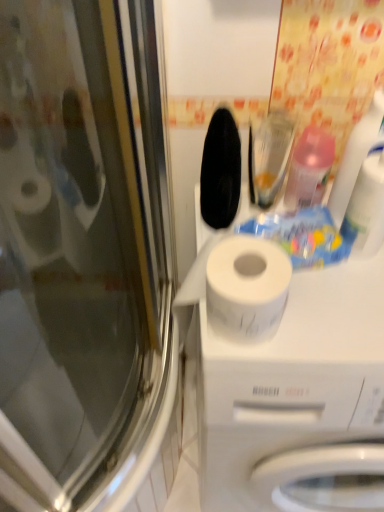
Describe the element at coordinates (357, 156) in the screenshot. The image size is (384, 512). I see `translucent plastic spray bottle at upper right, the second cleaning product positioned from the left` at that location.

What do you see at coordinates (309, 169) in the screenshot? Image resolution: width=384 pixels, height=512 pixels. I see `pink translucent bottle at upper right, the 1th cleaning product viewed from the left` at bounding box center [309, 169].

This screenshot has height=512, width=384. What are the coordinates of `transparent glass screen door at left` in the screenshot? It's located at (85, 261).

Is transparent glass screen door at left surrounded by white matte toilet paper at center?

Actually, transparent glass screen door at left is outside white matte toilet paper at center.

From a real-world perspective, which object rests below the other?

In real-world perspective, white matte toilet paper at center is lower.

Does white matte toilet paper at center turn towards transparent glass screen door at left?

No, white matte toilet paper at center is not facing towards transparent glass screen door at left.

Which of these two, white matte toilet paper at center or transparent glass screen door at left, is smaller?

Smaller between the two is transparent glass screen door at left.

Considering the positions of objects translucent plastic spray bottle at upper right, which is the first cleaning product in right-to-left order, and pink translucent bottle at upper right, the 1th cleaning product viewed from the left, in the image provided, who is more to the left, translucent plastic spray bottle at upper right, which is the first cleaning product in right-to-left order, or pink translucent bottle at upper right, the 1th cleaning product viewed from the left,?

pink translucent bottle at upper right, the 1th cleaning product viewed from the left, is more to the left.

Identify the location of cleaning product below the pink translucent bottle at upper right, acting as the second cleaning product starting from the right (from the image's perspective). (357, 156).

Is translucent plastic spray bottle at upper right, the second cleaning product positioned from the left, positioned far away from pink translucent bottle at upper right, acting as the second cleaning product starting from the right?

No.

In the image, there is a translucent plastic spray bottle at upper right, the second cleaning product positioned from the left. Where is `machine below it (from a real-world perspective)`? The image size is (384, 512). machine below it (from a real-world perspective) is located at coordinates (283, 368).

How far apart are white matte toilet paper at center and translucent plastic spray bottle at upper right, the second cleaning product positioned from the left?

white matte toilet paper at center and translucent plastic spray bottle at upper right, the second cleaning product positioned from the left, are 12.85 inches apart.

From a real-world perspective, is white matte toilet paper at center under translucent plastic spray bottle at upper right, the second cleaning product positioned from the left?

Yes, from a real-world perspective, white matte toilet paper at center is below translucent plastic spray bottle at upper right, the second cleaning product positioned from the left.

How different are the orientations of white matte toilet paper at center and translucent plastic spray bottle at upper right, which is the first cleaning product in right-to-left order, in degrees?

0.588 degrees separate the facing orientations of white matte toilet paper at center and translucent plastic spray bottle at upper right, which is the first cleaning product in right-to-left order.

From a real-world perspective, is transparent glass screen door at left under pink translucent bottle at upper right, the 1th cleaning product viewed from the left?

Yes, from a real-world perspective, transparent glass screen door at left is under pink translucent bottle at upper right, the 1th cleaning product viewed from the left.

Considering the positions of points (49, 291) and (299, 149), is point (49, 291) farther from camera compared to point (299, 149)?

Yes, point (49, 291) is behind point (299, 149).

From the picture: Is transparent glass screen door at left touching pink translucent bottle at upper right, acting as the second cleaning product starting from the right?

No, transparent glass screen door at left is not with pink translucent bottle at upper right, acting as the second cleaning product starting from the right.

From a real-world perspective, count 2nd cleaning products upward from the transparent glass screen door at left and point to it. Please provide its 2D coordinates.

[(357, 156)]

Is point (336, 207) closer or farther from the camera than point (100, 24)?

Point (336, 207) is positioned farther from the camera compared to point (100, 24).

Are translucent plastic spray bottle at upper right, the second cleaning product positioned from the left, and transparent glass screen door at left located far from each other?

No, translucent plastic spray bottle at upper right, the second cleaning product positioned from the left, is not far away from transparent glass screen door at left.

Can you confirm if translucent plastic spray bottle at upper right, which is the first cleaning product in right-to-left order, is bigger than transparent glass screen door at left?

Actually, translucent plastic spray bottle at upper right, which is the first cleaning product in right-to-left order, might be smaller than transparent glass screen door at left.

Is point (225, 486) positioned before point (289, 199)?

No.

Consider the image. Considering the sizes of white matte toilet paper at center and pink translucent bottle at upper right, the 1th cleaning product viewed from the left, in the image, is white matte toilet paper at center wider or thinner than pink translucent bottle at upper right, the 1th cleaning product viewed from the left,?

Clearly, white matte toilet paper at center has more width compared to pink translucent bottle at upper right, the 1th cleaning product viewed from the left.

From the image's perspective, is white matte toilet paper at center located beneath pink translucent bottle at upper right, the 1th cleaning product viewed from the left?

Correct, white matte toilet paper at center appears lower than pink translucent bottle at upper right, the 1th cleaning product viewed from the left, in the image.

Could you tell me if white matte toilet paper at center is facing pink translucent bottle at upper right, acting as the second cleaning product starting from the right?

No, white matte toilet paper at center is not oriented towards pink translucent bottle at upper right, acting as the second cleaning product starting from the right.

Can you confirm if transparent glass screen door at left is shorter than white matte toilet paper at center?

Correct, transparent glass screen door at left is not as tall as white matte toilet paper at center.

Does transparent glass screen door at left turn towards white matte toilet paper at center?

Yes, transparent glass screen door at left is oriented towards white matte toilet paper at center.

You are a GUI agent. You are given a task and a screenshot of the screen. Output one action in this format:
    pyautogui.click(x=<x>, y=<y>)
    Task: Click on the machine on the right of transparent glass screen door at left
    This screenshot has height=512, width=384.
    Given the screenshot: What is the action you would take?
    pyautogui.click(x=283, y=368)

Where is `cleaning product behind the translucent plastic spray bottle at upper right, the second cleaning product positioned from the left`? The height and width of the screenshot is (512, 384). cleaning product behind the translucent plastic spray bottle at upper right, the second cleaning product positioned from the left is located at coordinates click(309, 169).

Looking at the image, which one is located closer to pink translucent bottle at upper right, acting as the second cleaning product starting from the right, transparent glass screen door at left or translucent plastic spray bottle at upper right, the second cleaning product positioned from the left?

The object closer to pink translucent bottle at upper right, acting as the second cleaning product starting from the right, is translucent plastic spray bottle at upper right, the second cleaning product positioned from the left.

Estimate the real-world distances between objects in this image. Which object is further from transparent glass screen door at left, translucent plastic spray bottle at upper right, which is the first cleaning product in right-to-left order, or pink translucent bottle at upper right, acting as the second cleaning product starting from the right?

translucent plastic spray bottle at upper right, which is the first cleaning product in right-to-left order, is positioned further to the anchor transparent glass screen door at left.

Based on their spatial positions, is transparent glass screen door at left or white matte toilet paper at center further from translucent plastic spray bottle at upper right, which is the first cleaning product in right-to-left order?

transparent glass screen door at left.

Based on their spatial positions, is pink translucent bottle at upper right, acting as the second cleaning product starting from the right, or white matte toilet paper at center further from translucent plastic spray bottle at upper right, the second cleaning product positioned from the left?

Among the two, white matte toilet paper at center is located further to translucent plastic spray bottle at upper right, the second cleaning product positioned from the left.

From the picture: Estimate the real-world distances between objects in this image. Which object is closer to translucent plastic spray bottle at upper right, the second cleaning product positioned from the left, white matte toilet paper at center or transparent glass screen door at left?

white matte toilet paper at center is positioned closer to the anchor translucent plastic spray bottle at upper right, the second cleaning product positioned from the left.

Which object lies nearer to the anchor point pink translucent bottle at upper right, acting as the second cleaning product starting from the right, transparent glass screen door at left or white matte toilet paper at center?

white matte toilet paper at center is closer to pink translucent bottle at upper right, acting as the second cleaning product starting from the right.

Estimate the real-world distances between objects in this image. Which object is further from pink translucent bottle at upper right, acting as the second cleaning product starting from the right, translucent plastic spray bottle at upper right, the second cleaning product positioned from the left, or white matte toilet paper at center?

white matte toilet paper at center.

Consider the image. Based on their spatial positions, is translucent plastic spray bottle at upper right, which is the first cleaning product in right-to-left order, or pink translucent bottle at upper right, the 1th cleaning product viewed from the left, further from white matte toilet paper at center?

Based on the image, pink translucent bottle at upper right, the 1th cleaning product viewed from the left, appears to be further to white matte toilet paper at center.

The image size is (384, 512). In order to click on cleaning product between transparent glass screen door at left and translucent plastic spray bottle at upper right, which is the first cleaning product in right-to-left order in this screenshot , I will do `click(309, 169)`.

I want to click on cleaning product between pink translucent bottle at upper right, acting as the second cleaning product starting from the right, and white matte toilet paper at center in the up-down direction, so click(x=357, y=156).